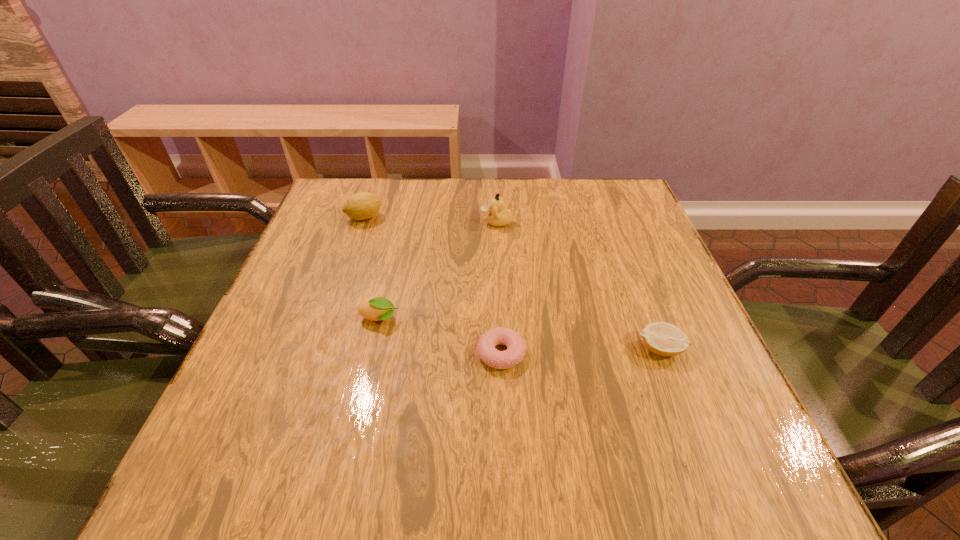
This screenshot has width=960, height=540. I want to click on vacant area that lies between the second shortest object and the leftmost object, so pos(513,283).

At what (x,y) coordinates should I click in order to perform the action: click on empty location between the shortest object and the second farthest lemon. Please return your answer as a coordinate pair (x, y). Looking at the image, I should click on (440, 336).

The image size is (960, 540). I want to click on vacant area between the rightmost lemon and the third nearest object, so click(519, 334).

I want to click on vacant area that lies between the shortest object and the third nearest object, so click(x=440, y=336).

Find the location of a particular element. This screenshot has width=960, height=540. vacant point located between the tallest object and the doughnut is located at coordinates (499, 288).

Find the location of `vacant point located between the farthest lemon and the doughnut`. vacant point located between the farthest lemon and the doughnut is located at coordinates (433, 286).

Where is `object that can be found as the third closest to the farthest lemon`? object that can be found as the third closest to the farthest lemon is located at coordinates (515, 352).

The width and height of the screenshot is (960, 540). Identify the location of the fourth closest object to the shortest lemon. (361, 206).

Identify which lemon is the second closest to the tallest lemon. Please provide its 2D coordinates. Your answer should be formatted as a tuple, i.e. [(x, y)], where the tuple contains the x and y coordinates of a point satisfying the conditions above.

[(665, 339)]

Identify which lemon is the second nearest to the tallest object. Please provide its 2D coordinates. Your answer should be formatted as a tuple, i.e. [(x, y)], where the tuple contains the x and y coordinates of a point satisfying the conditions above.

[(376, 308)]